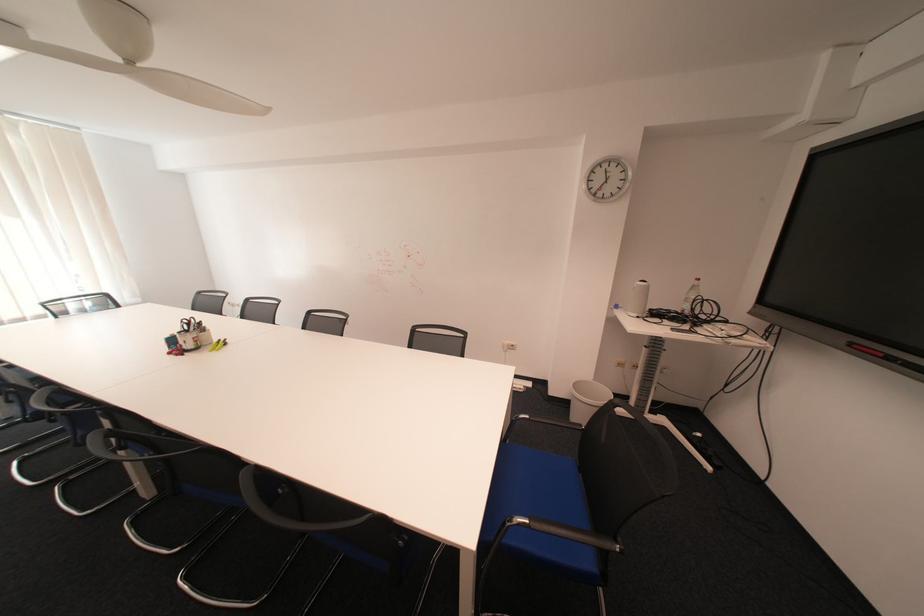
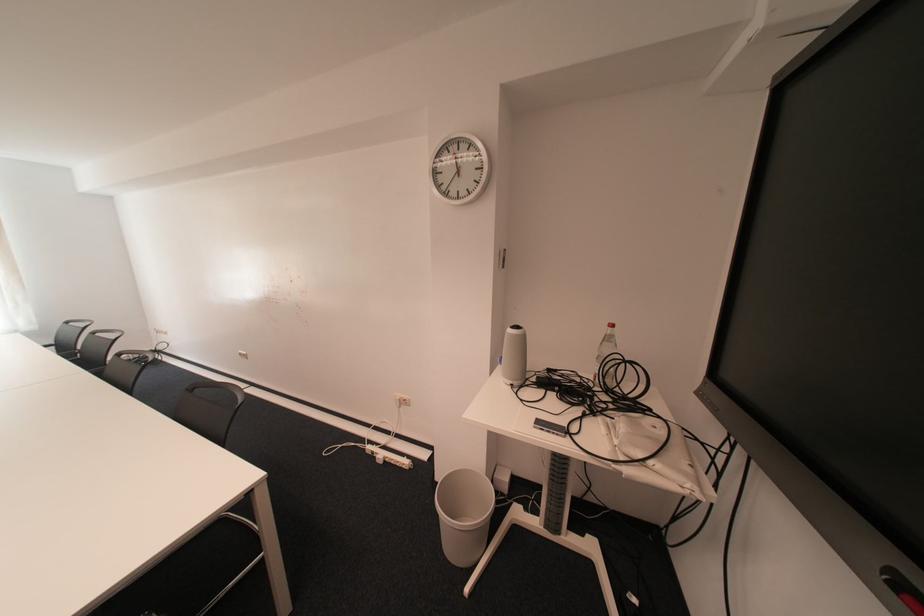
Locate, in the second image, the point that corresponds to (x=515, y=344) in the first image.

(407, 397)